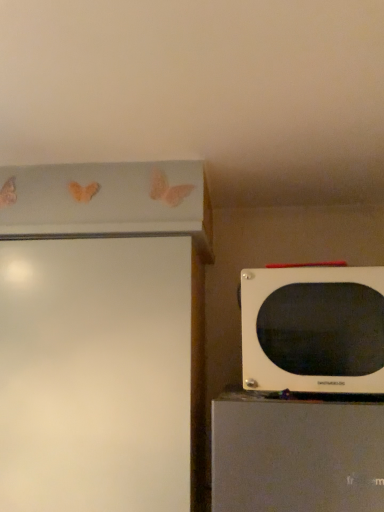
Question: Can you confirm if white matte microwave at right is positioned to the right of white glossy screen door at left?

Choices:
 (A) no
 (B) yes

Answer: (B)

Question: Is white matte microwave at right facing away from white glossy screen door at left?

Choices:
 (A) yes
 (B) no

Answer: (B)

Question: Can you confirm if white matte microwave at right is taller than white glossy screen door at left?

Choices:
 (A) no
 (B) yes

Answer: (A)

Question: From a real-world perspective, does white matte microwave at right stand above white glossy screen door at left?

Choices:
 (A) no
 (B) yes

Answer: (B)

Question: Is white matte microwave at right far from white glossy screen door at left?

Choices:
 (A) yes
 (B) no

Answer: (B)

Question: Is white matte microwave at right in front of white glossy screen door at left?

Choices:
 (A) yes
 (B) no

Answer: (A)

Question: From a real-world perspective, is white glossy screen door at left positioned under white matte microwave at right based on gravity?

Choices:
 (A) yes
 (B) no

Answer: (A)

Question: Can you confirm if white glossy screen door at left is thinner than white matte microwave at right?

Choices:
 (A) no
 (B) yes

Answer: (A)

Question: Is white glossy screen door at left at the right side of white matte microwave at right?

Choices:
 (A) yes
 (B) no

Answer: (B)

Question: Can you confirm if white glossy screen door at left is shorter than white matte microwave at right?

Choices:
 (A) yes
 (B) no

Answer: (B)

Question: Is white glossy screen door at left closer to the viewer compared to white matte microwave at right?

Choices:
 (A) no
 (B) yes

Answer: (A)

Question: Would you say white glossy screen door at left is outside white matte microwave at right?

Choices:
 (A) no
 (B) yes

Answer: (B)

Question: From a real-world perspective, is white matte microwave at right positioned above or below white glossy screen door at left?

Choices:
 (A) above
 (B) below

Answer: (A)